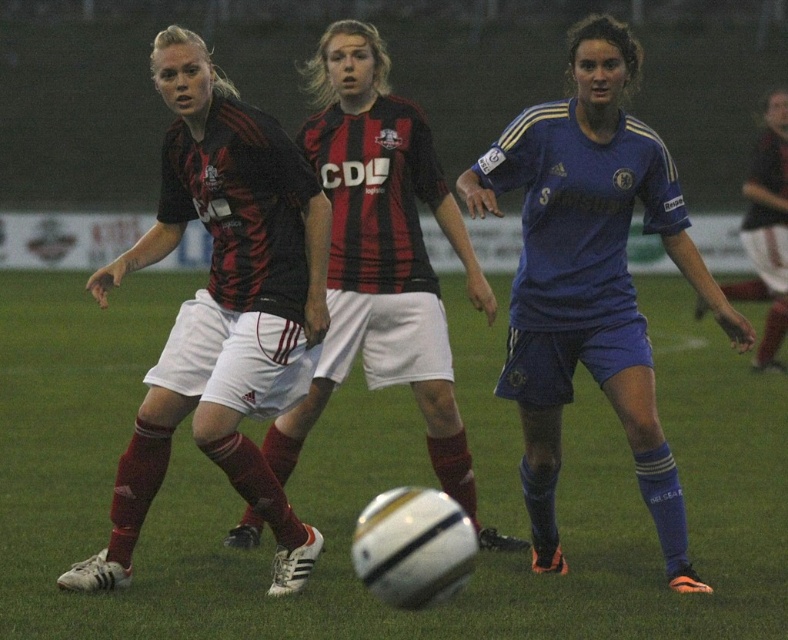
Does white smooth soccer ball at center appear on the left side of blue jersey at center?

Correct, you'll find white smooth soccer ball at center to the left of blue jersey at center.

Is white smooth soccer ball at center wider than blue jersey at center?

Yes, white smooth soccer ball at center is wider than blue jersey at center.

What do you see at coordinates (374, 493) in the screenshot? Image resolution: width=788 pixels, height=640 pixels. I see `white smooth soccer ball at center` at bounding box center [374, 493].

Identify the location of white smooth soccer ball at center. (374, 493).

Is white smooth soccer ball at center positioned behind black matte soccer ball at center?

No.

Is white smooth soccer ball at center to the left of black matte soccer ball at center from the viewer's perspective?

Incorrect, white smooth soccer ball at center is not on the left side of black matte soccer ball at center.

Identify the location of white smooth soccer ball at center. This screenshot has height=640, width=788. (374, 493).

Identify the location of white smooth soccer ball at center. 374,493.

Consider the image. Which of these two, black matte jersey at left or blue jersey at center, stands shorter?

black matte jersey at left

Is black matte jersey at left to the left of blue jersey at center from the viewer's perspective?

Indeed, black matte jersey at left is positioned on the left side of blue jersey at center.

Is point (288, 230) more distant than point (556, 198)?

No.

You are a GUI agent. You are given a task and a screenshot of the screen. Output one action in this format:
    pyautogui.click(x=<x>, y=<y>)
    Task: Click on the black matte jersey at left
    
    Given the screenshot: What is the action you would take?
    [x=222, y=307]